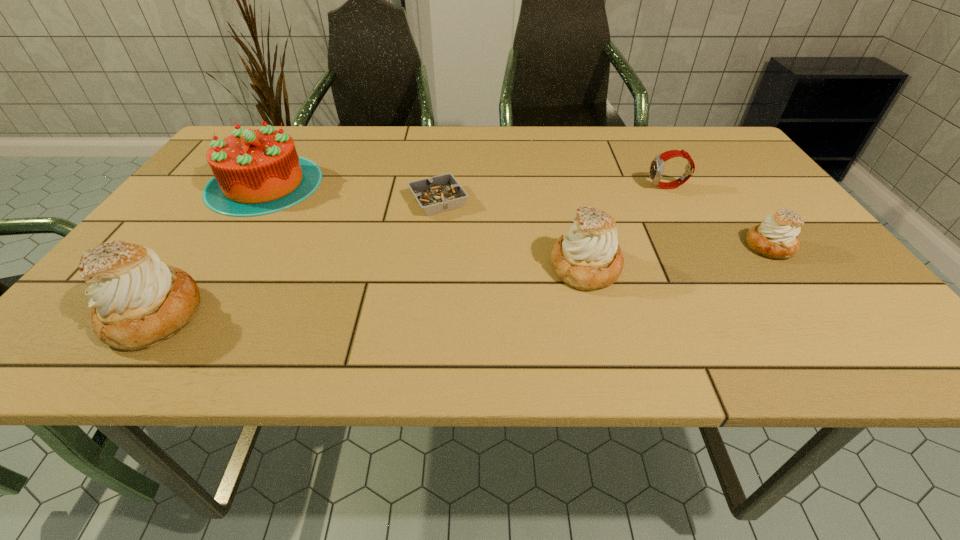
Where is `object that is at the right edge`? object that is at the right edge is located at coordinates (776, 238).

At what (x,y) coordinates should I click in order to perform the action: click on object that is at the far left corner. Please return your answer as a coordinate pair (x, y). This screenshot has height=540, width=960. Looking at the image, I should click on tap(256, 172).

Find the location of `object present at the near left corner`. object present at the near left corner is located at coordinates (137, 301).

Identify the location of vacant space at the far edge of the desktop. This screenshot has height=540, width=960. (477, 140).

Where is `free space at the near edge of the desktop`? This screenshot has height=540, width=960. free space at the near edge of the desktop is located at coordinates (271, 307).

You are a GUI agent. You are given a task and a screenshot of the screen. Output one action in this format:
    pyautogui.click(x=<x>, y=<y>)
    Task: Click on the vacant space at the left edge of the desktop
    
    Given the screenshot: What is the action you would take?
    pyautogui.click(x=194, y=242)

You are a GUI agent. You are given a task and a screenshot of the screen. Output one action in this format:
    pyautogui.click(x=<x>, y=<y>)
    Task: Click on the free region at the far left corner
    This screenshot has width=960, height=540.
    Given the screenshot: What is the action you would take?
    pyautogui.click(x=251, y=128)

Find the location of `free space between the third object from left to right and the leftmost pastry`. free space between the third object from left to right and the leftmost pastry is located at coordinates (296, 258).

Where is `free spot between the fourth shortest object and the rightmost object`? free spot between the fourth shortest object and the rightmost object is located at coordinates [x=678, y=257].

Where is `empty space that is in between the third object from right to left and the rightmost object`? empty space that is in between the third object from right to left and the rightmost object is located at coordinates (678, 257).